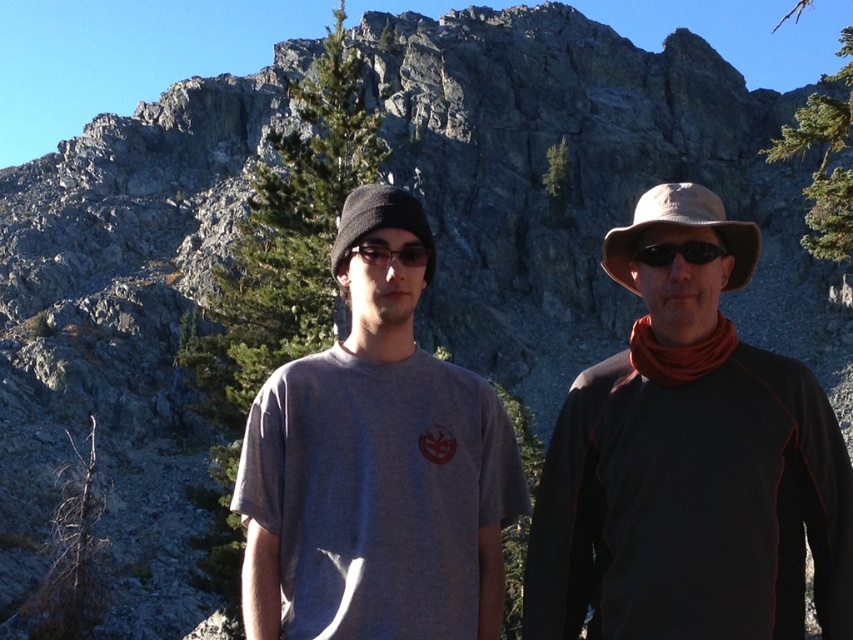
Question: Among these points, which one is nearest to the camera?

Choices:
 (A) (585, 605)
 (B) (207, 561)
 (C) (427, 257)

Answer: (A)

Question: Which object is farther from the camera taking this photo?

Choices:
 (A) green textured pine at upper right
 (B) gray cotton t-shirt at center
 (C) dark gray fabric shirt at right

Answer: (A)

Question: Considering the relative positions of dark gray fabric shirt at right and black matte sunglasses at center in the image provided, where is dark gray fabric shirt at right located with respect to black matte sunglasses at center?

Choices:
 (A) left
 (B) right

Answer: (B)

Question: Can you confirm if green textured pine at upper right is positioned below black matte sunglasses at center?

Choices:
 (A) yes
 (B) no

Answer: (B)

Question: Does gray cotton t-shirt at center come behind green textured pine at upper right?

Choices:
 (A) no
 (B) yes

Answer: (A)

Question: Which of these objects is positioned closest to the sunglasses at center?

Choices:
 (A) green leafy pine at center
 (B) gray cotton t-shirt at center
 (C) dark gray fabric shirt at right
 (D) black matte sunglasses at center

Answer: (B)